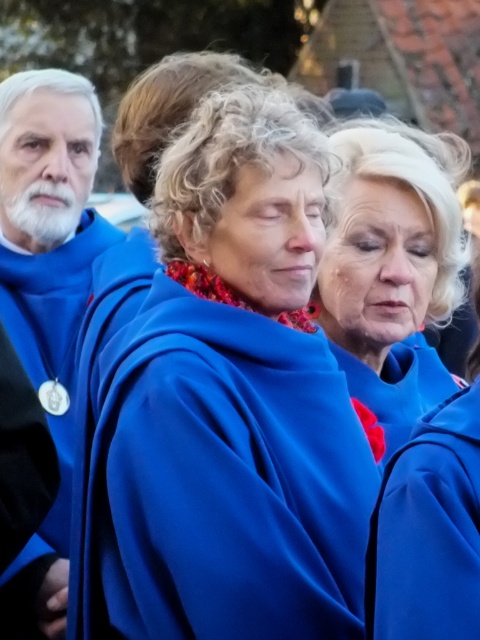
Does blue woolen coat at center appear over blue smooth robe at center?

Correct, blue woolen coat at center is located above blue smooth robe at center.

Is point (372, 410) more distant than point (470, 604)?

Yes.

The image size is (480, 640). What do you see at coordinates (392, 266) in the screenshot? I see `blue woolen coat at center` at bounding box center [392, 266].

In order to click on blue woolen coat at center in this screenshot , I will do `click(392, 266)`.

Can you confirm if blue matte coat at center is smaller than blue woolen coat at center?

Indeed, blue matte coat at center has a smaller size compared to blue woolen coat at center.

Is point (182, 150) closer to camera compared to point (367, 195)?

That is True.

Which is in front, point (187, 588) or point (442, 218)?

Positioned in front is point (187, 588).

At what (x,y) coordinates should I click in order to perform the action: click on blue matte coat at center. Please return your answer as a coordinate pair (x, y). The image size is (480, 640). Looking at the image, I should click on (227, 406).

Can you confirm if blue matte coat at center is taller than blue smooth robe at center?

Indeed, blue matte coat at center has a greater height compared to blue smooth robe at center.

Can you confirm if blue matte coat at center is positioned to the right of blue smooth robe at center?

In fact, blue matte coat at center is to the left of blue smooth robe at center.

Which is in front, point (194, 259) or point (386, 476)?

Point (386, 476) is more forward.

This screenshot has height=640, width=480. Identify the location of blue matte coat at center. (227, 406).